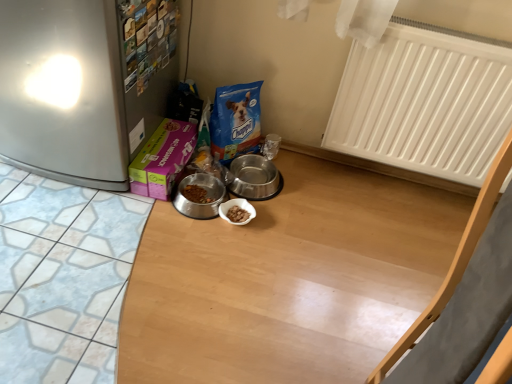
This screenshot has height=384, width=512. Find the location of `free point above matte purple box at center-left (from a real-world perspective)`. free point above matte purple box at center-left (from a real-world perspective) is located at coordinates (181, 136).